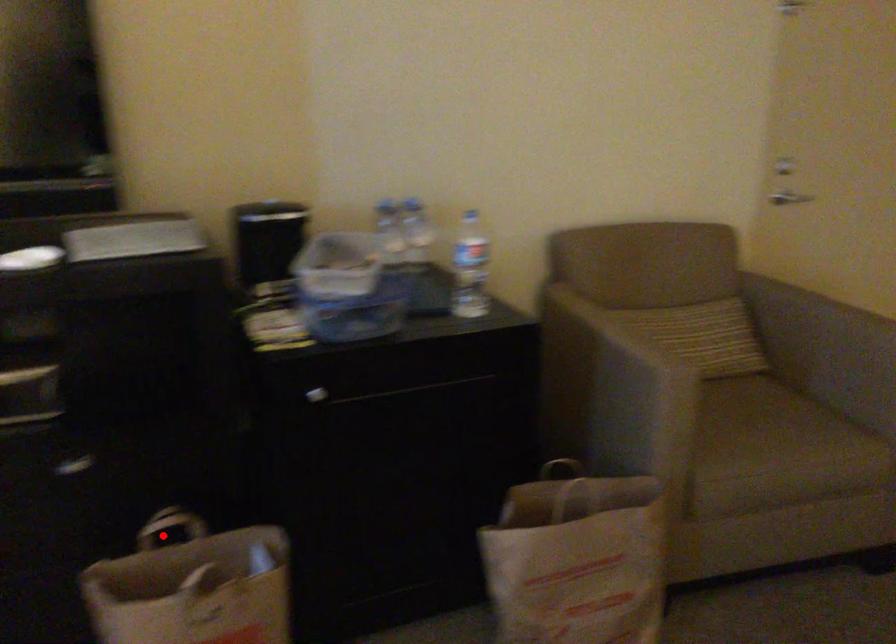
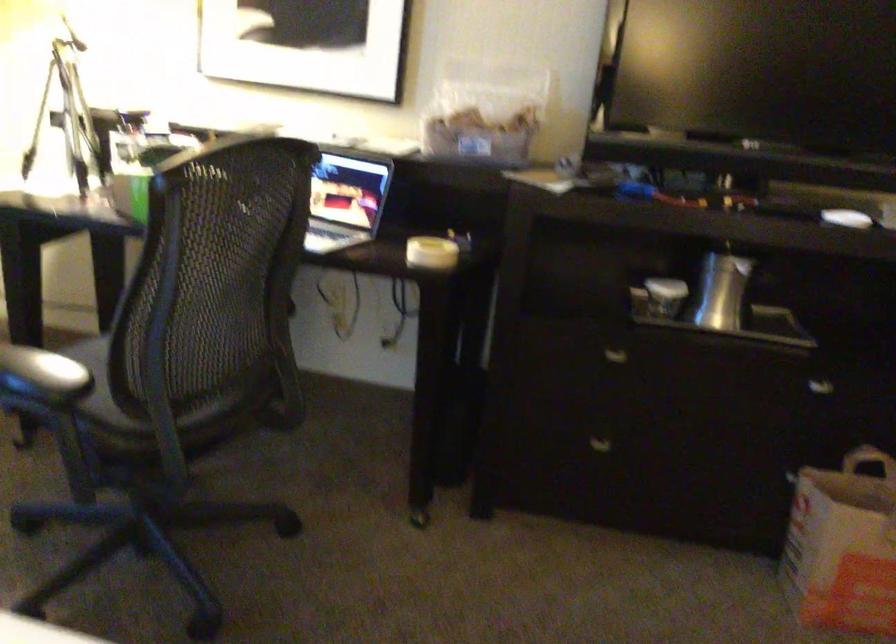
In the second image, find the point that corresponds to the highlighted location in the first image.

(867, 460)